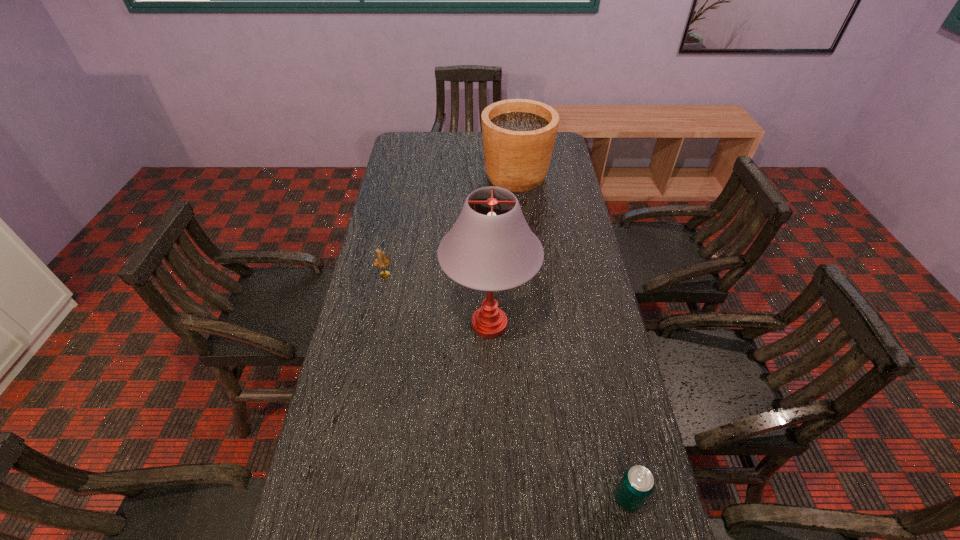
Where is `unoccupied area between the nearest object and the leftmost object`? unoccupied area between the nearest object and the leftmost object is located at coordinates (506, 387).

The width and height of the screenshot is (960, 540). Identify the location of unoccupied area between the farthest object and the candle holder. (450, 225).

Image resolution: width=960 pixels, height=540 pixels. What are the coordinates of `free space that is in between the beer can and the second nearest object` in the screenshot? It's located at (559, 411).

Where is `vacant space that's between the second nearest object and the candle holder`? Image resolution: width=960 pixels, height=540 pixels. vacant space that's between the second nearest object and the candle holder is located at coordinates (437, 299).

Find the location of a particular element. This screenshot has width=960, height=540. vacant space in between the nearest object and the third nearest object is located at coordinates (506, 387).

Image resolution: width=960 pixels, height=540 pixels. I want to click on empty space that is in between the table lamp and the beer can, so click(x=559, y=411).

Where is `free space between the nearest object and the flowerpot`? The width and height of the screenshot is (960, 540). free space between the nearest object and the flowerpot is located at coordinates (572, 337).

Identify which object is the second closest to the flowerpot. Please provide its 2D coordinates. Your answer should be formatted as a tuple, i.e. [(x, y)], where the tuple contains the x and y coordinates of a point satisfying the conditions above.

[(490, 248)]

Select which object appears as the closest to the beer can. Please provide its 2D coordinates. Your answer should be formatted as a tuple, i.e. [(x, y)], where the tuple contains the x and y coordinates of a point satisfying the conditions above.

[(490, 248)]

Where is `free space that satisfies the following two spatial constraints: 1. on the front-facing side of the table lamp; 2. on the left side of the beer can`? The width and height of the screenshot is (960, 540). free space that satisfies the following two spatial constraints: 1. on the front-facing side of the table lamp; 2. on the left side of the beer can is located at coordinates (492, 498).